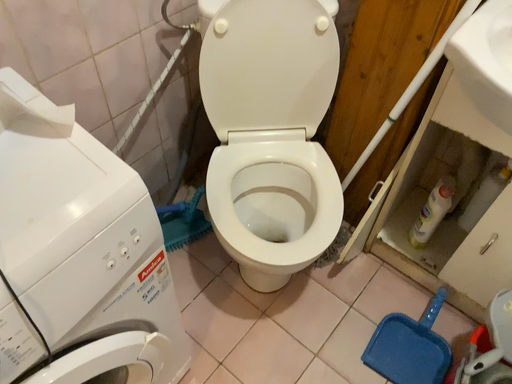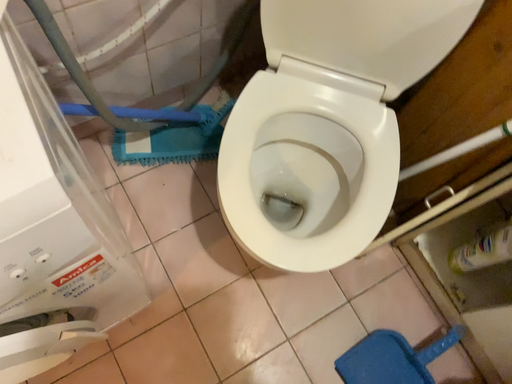
Question: Which way did the camera rotate in the video?

Choices:
 (A) rotated upward
 (B) rotated downward

Answer: (B)